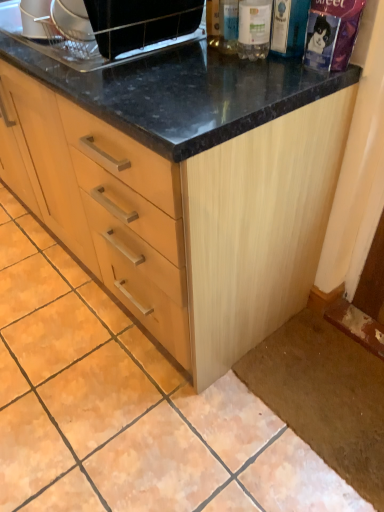
At what (x,y) coordinates should I click in order to perform the action: click on vacant region to the left of clear plastic bottle at upper right, positioned as the second bottle in right-to-left order. Please return your answer as a coordinate pair (x, y). Looking at the image, I should click on (192, 64).